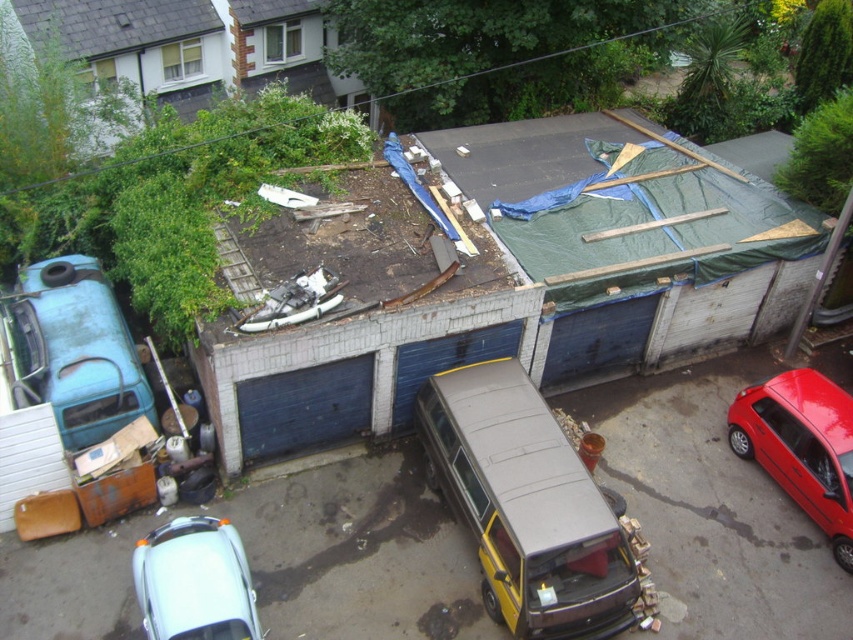
Question: Does shiny red car at lower right have a lesser width compared to white matte car at lower left?

Choices:
 (A) no
 (B) yes

Answer: (B)

Question: Does yellow matte van at center appear on the left side of rusty metal van at left?

Choices:
 (A) yes
 (B) no

Answer: (B)

Question: Which object is closer to the camera taking this photo?

Choices:
 (A) shiny red car at lower right
 (B) yellow matte van at center
 (C) rusty metal van at left
 (D) white matte car at lower left

Answer: (D)

Question: Which object is farther from the camera taking this photo?

Choices:
 (A) yellow matte van at center
 (B) rusty metal van at left
 (C) shiny red car at lower right
 (D) white matte car at lower left

Answer: (C)

Question: Estimate the real-world distances between objects in this image. Which object is closer to the white matte car at lower left?

Choices:
 (A) yellow matte van at center
 (B) rusty metal van at left

Answer: (B)

Question: Does yellow matte van at center have a lesser width compared to rusty metal van at left?

Choices:
 (A) no
 (B) yes

Answer: (A)